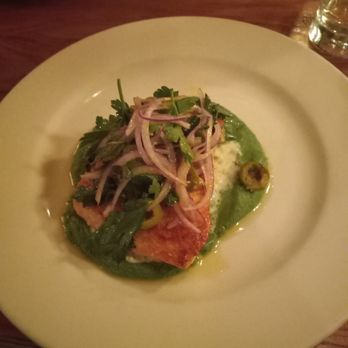
Locate an element on the screen. Image resolution: width=348 pixels, height=348 pixels. cup is located at coordinates (337, 33).